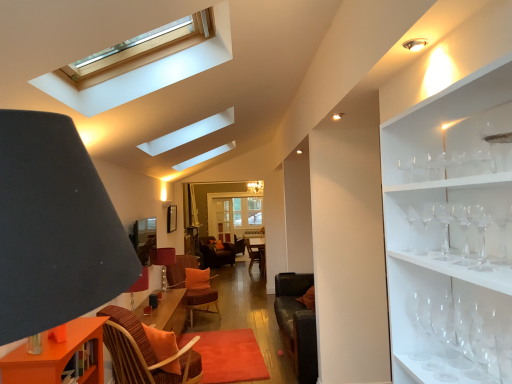
What is the approximate width of rattan wicker chair with orange cushion at center?

34.91 centimeters.

Locate an element on the screen. The height and width of the screenshot is (384, 512). matte gold spotlight at upper right is located at coordinates (415, 44).

What do you see at coordinates (415, 44) in the screenshot?
I see `matte gold spotlight at upper right` at bounding box center [415, 44].

What is the approximate width of clear glass wine glass at right, positioned as the third wine glass in back-to-front order?

It is 8.89 centimeters.

Identify the location of clear glass wine glass at right, which appears as the fifth wine glass when viewed from the back. Image resolution: width=512 pixels, height=384 pixels. (444, 227).

Is orange fabric pillow at center positioned beyond the bounds of transparent glass wine glass at right, placed as the first wine glass when sorted from back to front?

Yes, orange fabric pillow at center is not within transparent glass wine glass at right, placed as the first wine glass when sorted from back to front.

Is orange fabric pillow at center thinner than transparent glass wine glass at right, arranged as the eighth wine glass when viewed from the front?

In fact, orange fabric pillow at center might be wider than transparent glass wine glass at right, arranged as the eighth wine glass when viewed from the front.

What's the angular difference between orange fabric pillow at center and transparent glass wine glass at right, arranged as the eighth wine glass when viewed from the front,'s facing directions?

The facing directions of orange fabric pillow at center and transparent glass wine glass at right, arranged as the eighth wine glass when viewed from the front, are 111 degrees apart.

Measure the distance between orange fabric pillow at center and transparent glass wine glass at right, arranged as the eighth wine glass when viewed from the front.

orange fabric pillow at center is 4.47 meters away from transparent glass wine glass at right, arranged as the eighth wine glass when viewed from the front.

Is orange fabric swivel chair at center at the left side of transparent glass wine glass at right, the 4th wine glass when ordered from back to front?

Indeed, orange fabric swivel chair at center is positioned on the left side of transparent glass wine glass at right, the 4th wine glass when ordered from back to front.

From the image's perspective, would you say orange fabric swivel chair at center is positioned over transparent glass wine glass at right, the 4th wine glass when ordered from back to front?

No.

Is orange fabric swivel chair at center not near transparent glass wine glass at right, the 4th wine glass when ordered from back to front?

Absolutely, orange fabric swivel chair at center is distant from transparent glass wine glass at right, the 4th wine glass when ordered from back to front.

Measure the distance between orange fabric swivel chair at center and transparent glass wine glass at right, the 4th wine glass when ordered from back to front.

They are 4.51 meters apart.

Is transparent glass wine glass at right, the 6th wine glass when ordered from back to front, outside of clear glass wine glass at right, arranged as the fourth wine glass when viewed from the front?

Yes.

From a real-world perspective, is transparent glass wine glass at right, the 6th wine glass when ordered from back to front, on top of clear glass wine glass at right, arranged as the fourth wine glass when viewed from the front?

No, from a real-world perspective, transparent glass wine glass at right, the 6th wine glass when ordered from back to front, is not above clear glass wine glass at right, arranged as the fourth wine glass when viewed from the front.

Is transparent glass wine glass at right, the 3th wine glass from the front, positioned with its back to clear glass wine glass at right, which appears as the fifth wine glass when viewed from the back?

transparent glass wine glass at right, the 3th wine glass from the front, does not have its back to clear glass wine glass at right, which appears as the fifth wine glass when viewed from the back.

Consider the image. From the image's perspective, between transparent glass wine glass at right, the 3th wine glass from the front, and clear glass wine glass at right, which appears as the fifth wine glass when viewed from the back, who is located below?

From the image's view, transparent glass wine glass at right, the 3th wine glass from the front, is below.

Based on the photo, do you think transparent glass wine glass at right, the fifth wine glass from the front, is within clear glass wine glass at right, arranged as the 1th wine glass when viewed from the front, or outside of it?

transparent glass wine glass at right, the fifth wine glass from the front, is not enclosed by clear glass wine glass at right, arranged as the 1th wine glass when viewed from the front.

Which is more to the right, transparent glass wine glass at right, the 4th wine glass when ordered from back to front, or clear glass wine glass at right, arranged as the 1th wine glass when viewed from the front?

clear glass wine glass at right, arranged as the 1th wine glass when viewed from the front.

Could you tell me if transparent glass wine glass at right, the 4th wine glass when ordered from back to front, is turned towards clear glass wine glass at right, arranged as the 1th wine glass when viewed from the front?

No, transparent glass wine glass at right, the 4th wine glass when ordered from back to front, does not turn towards clear glass wine glass at right, arranged as the 1th wine glass when viewed from the front.

Can you confirm if orange wood table at lower left is smaller than transparent glass wine glass at right, the 4th wine glass when ordered from back to front?

Incorrect, orange wood table at lower left is not smaller in size than transparent glass wine glass at right, the 4th wine glass when ordered from back to front.

In terms of height, does orange wood table at lower left look taller or shorter compared to transparent glass wine glass at right, the fifth wine glass from the front?

orange wood table at lower left is taller than transparent glass wine glass at right, the fifth wine glass from the front.

Is orange wood table at lower left turned away from transparent glass wine glass at right, the fifth wine glass from the front?

orange wood table at lower left does not have its back to transparent glass wine glass at right, the fifth wine glass from the front.

From a real-world perspective, is matte brown table lamp at center positioned above or below transparent glass wine glass at right, the 6th wine glass when ordered from back to front?

In terms of real-world spatial position, matte brown table lamp at center is below transparent glass wine glass at right, the 6th wine glass when ordered from back to front.

From the picture: Is matte brown table lamp at center outside of transparent glass wine glass at right, the 3th wine glass from the front?

That's correct, matte brown table lamp at center is outside of transparent glass wine glass at right, the 3th wine glass from the front.

From the image's perspective, is matte brown table lamp at center located above or below transparent glass wine glass at right, the 6th wine glass when ordered from back to front?

Based on their image positions, matte brown table lamp at center is located beneath transparent glass wine glass at right, the 6th wine glass when ordered from back to front.

Is clear glass wine glass at right, the eighth wine glass in the back-to-front sequence, completely or partially inside clear glass skylight at upper center?

No, clear glass wine glass at right, the eighth wine glass in the back-to-front sequence, is not a part of clear glass skylight at upper center.

Is clear glass skylight at upper center far away from clear glass wine glass at right, arranged as the 1th wine glass when viewed from the front?

That's right, there is a large distance between clear glass skylight at upper center and clear glass wine glass at right, arranged as the 1th wine glass when viewed from the front.

Considering the relative sizes of clear glass skylight at upper center and clear glass wine glass at right, arranged as the 1th wine glass when viewed from the front, in the image provided, is clear glass skylight at upper center bigger than clear glass wine glass at right, arranged as the 1th wine glass when viewed from the front,?

Indeed, clear glass skylight at upper center has a larger size compared to clear glass wine glass at right, arranged as the 1th wine glass when viewed from the front.

From a real-world perspective, is clear glass skylight at upper center beneath clear glass wine glass at right, the eighth wine glass in the back-to-front sequence?

No, from a real-world perspective, clear glass skylight at upper center is not below clear glass wine glass at right, the eighth wine glass in the back-to-front sequence.

You are a GUI agent. You are given a task and a screenshot of the screen. Output one action in this format:
    pyautogui.click(x=<x>, y=<y>)
    Task: Click on the pillow that appears below the transparent glass wine glass at right, arranged as the eighth wine glass when viewed from the front (from a real-world perspective)
    The width and height of the screenshot is (512, 384).
    Given the screenshot: What is the action you would take?
    [197, 278]

Locate an element on the screen. swivel chair that appears behind the transparent glass wine glass at right, the 4th wine glass when ordered from back to front is located at coordinates (x=193, y=286).

From the image, which object appears to be farther from transparent glass wine glass at right, the 3th wine glass from the front, orange wood table at lower left or orange fabric pillow at center?

orange fabric pillow at center is further to transparent glass wine glass at right, the 3th wine glass from the front.

Looking at the image, which one is located further to clear glass skylight at upper center, transparent glass wine glass at right, the 6th wine glass when ordered from back to front, or orange fabric pillow at center?

Based on the image, orange fabric pillow at center appears to be further to clear glass skylight at upper center.

Looking at this image, looking at the image, which one is located closer to clear glass wine glass at right, arranged as the 1th wine glass when viewed from the front, matte gold spotlight at upper right or clear glass wine glass at right, which appears as the fifth wine glass when viewed from the back?

Among the two, clear glass wine glass at right, which appears as the fifth wine glass when viewed from the back, is located nearer to clear glass wine glass at right, arranged as the 1th wine glass when viewed from the front.

Considering their positions, is orange fabric swivel chair at center positioned closer to orange wood table at lower left than rattan wicker chair with orange cushion at center?

rattan wicker chair with orange cushion at center lies closer to orange wood table at lower left than the other object.

Based on their spatial positions, is clear glass wine glass at right, arranged as the fourth wine glass when viewed from the front, or transparent glass wine glass at right, the fifth wine glass from the front, closer to orange fabric pillow at center?

Based on the image, transparent glass wine glass at right, the fifth wine glass from the front, appears to be nearer to orange fabric pillow at center.

Estimate the real-world distances between objects in this image. Which object is further from matte brown table lamp at center, clear glass wine glass at right, positioned as the third wine glass in back-to-front order, or matte gold spotlight at upper right?

The object further to matte brown table lamp at center is matte gold spotlight at upper right.

Looking at the image, which one is located closer to clear glass wine glass at right, which ranks as the seventh wine glass in back-to-front order, rattan wicker chair with orange cushion at center or clear glass wine glass at right, placed as the sixth wine glass when sorted from front to back?

clear glass wine glass at right, placed as the sixth wine glass when sorted from front to back, is positioned closer to the anchor clear glass wine glass at right, which ranks as the seventh wine glass in back-to-front order.

Based on their spatial positions, is clear glass wine glass at right, placed as the sixth wine glass when sorted from front to back, or transparent glass wine glass at right, the 6th wine glass when ordered from back to front, further from transparent glass wine glass at right, which ranks as the 2th wine glass in back-to-front order?

Based on the image, clear glass wine glass at right, placed as the sixth wine glass when sorted from front to back, appears to be further to transparent glass wine glass at right, which ranks as the 2th wine glass in back-to-front order.

What are the coordinates of `chair between transparent glass wine glass at right, which ranks as the 2th wine glass in back-to-front order, and orange fabric pillow at center from front to back` in the screenshot? It's located at (131, 330).

Where is `chair between orange wood table at lower left and clear glass wine glass at right, which appears as the fifth wine glass when viewed from the back, in the horizontal direction`? Image resolution: width=512 pixels, height=384 pixels. chair between orange wood table at lower left and clear glass wine glass at right, which appears as the fifth wine glass when viewed from the back, in the horizontal direction is located at coordinates (131, 330).

The height and width of the screenshot is (384, 512). Find the location of `lamp located between clear glass wine glass at right, which appears as the fifth wine glass when viewed from the back, and orange fabric pillow at center in the depth direction`. lamp located between clear glass wine glass at right, which appears as the fifth wine glass when viewed from the back, and orange fabric pillow at center in the depth direction is located at coordinates 415,44.

Identify the location of chair between transparent glass wine glass at right, arranged as the eighth wine glass when viewed from the front, and orange fabric swivel chair at center, along the z-axis. This screenshot has width=512, height=384. (131, 330).